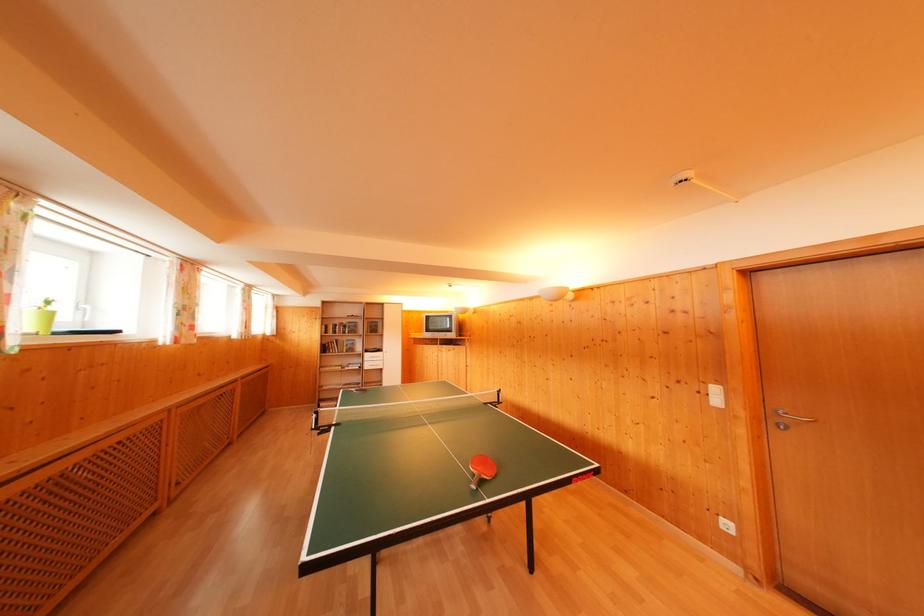
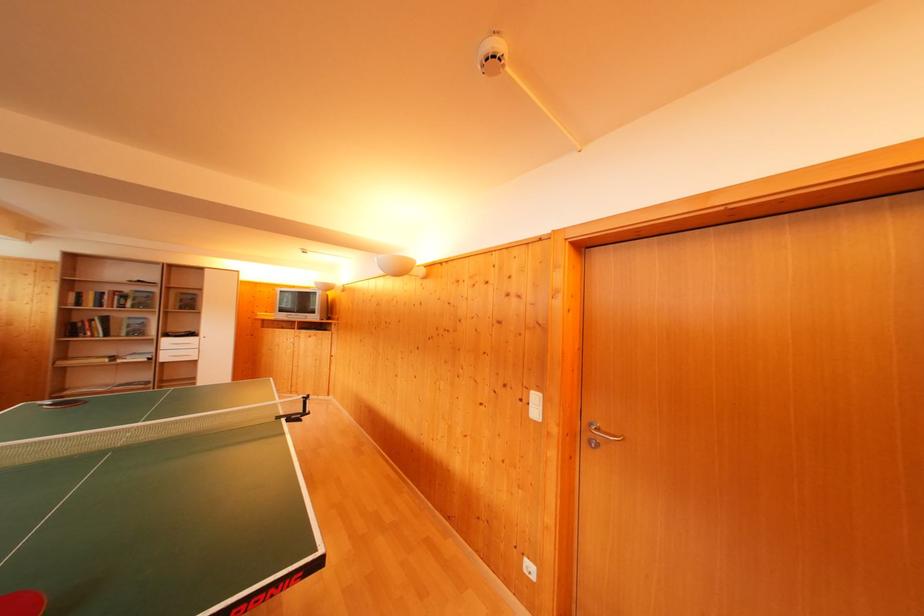
In the second image, find the point that corresponds to (342,328) in the first image.

(112, 294)